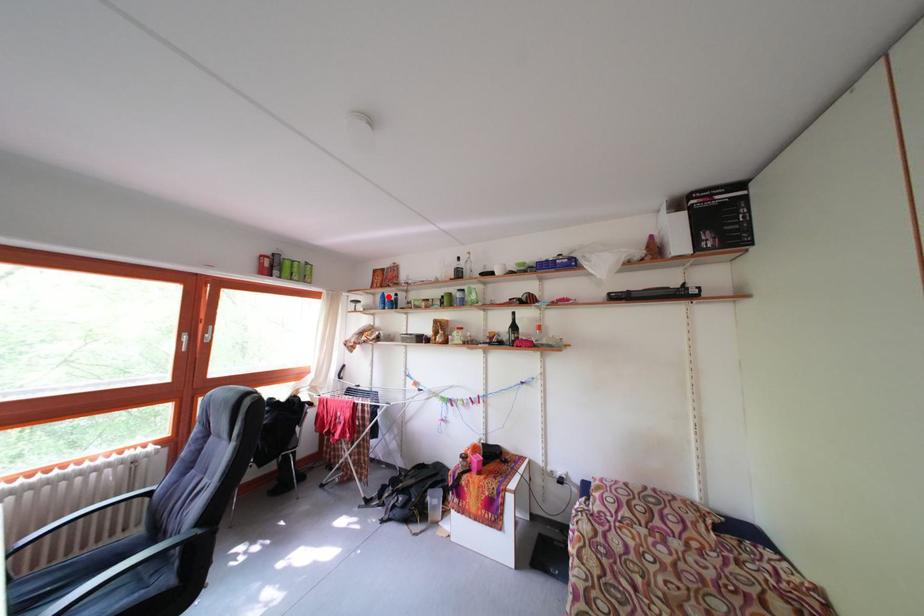
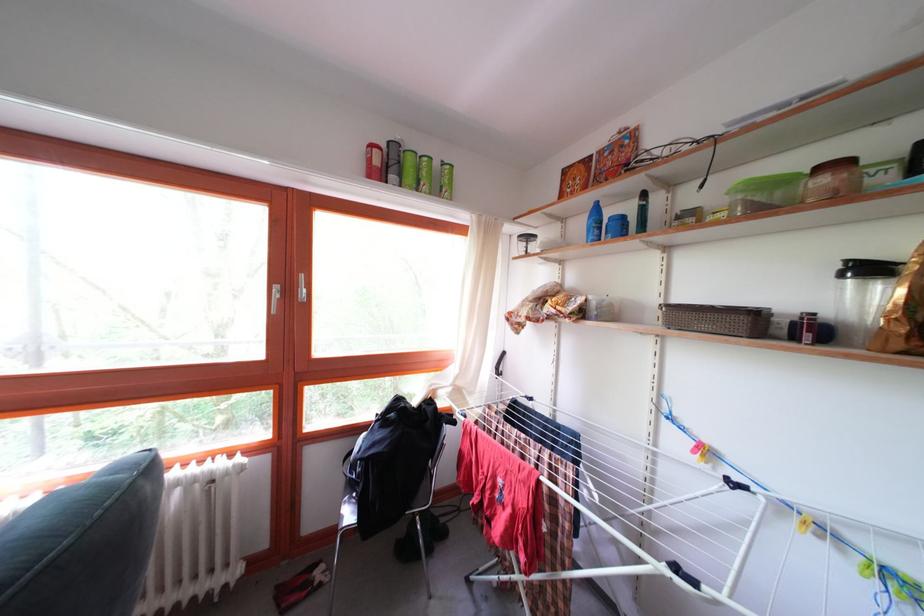
Locate, in the second image, the point that corresponds to the highlighted location in the first image.

(598, 204)